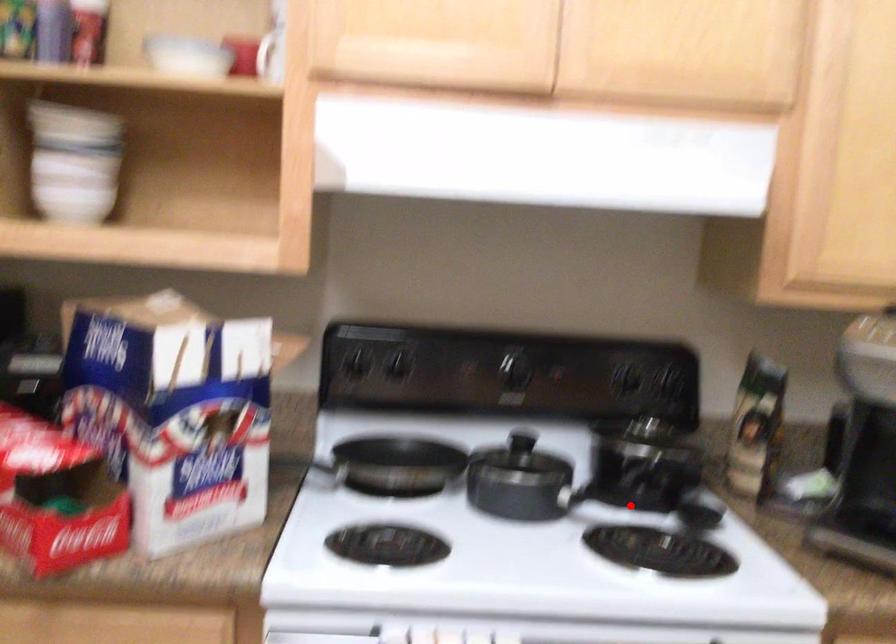
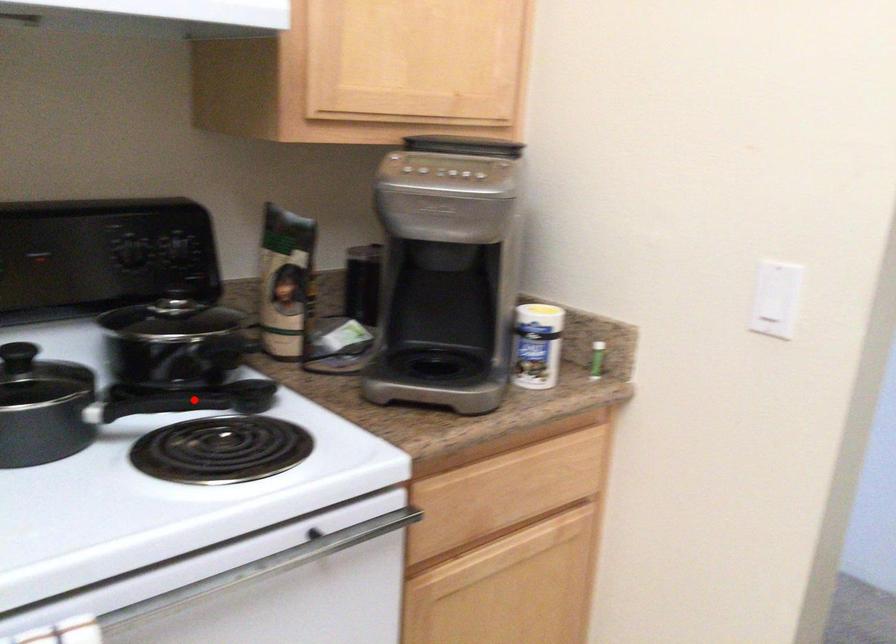
I am providing you with two images of the same scene from different viewpoints. A red point is marked on the first image and another point is marked on the second image. Are the points marked in image1 and image2 representing the same 3D position?

Yes